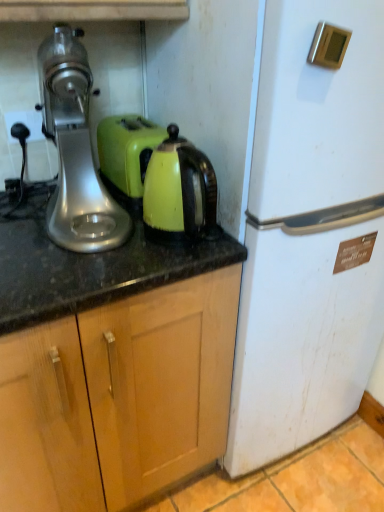
What are the coordinates of `free space in front of silver metallic stand mixer at left` in the screenshot? It's located at (61, 266).